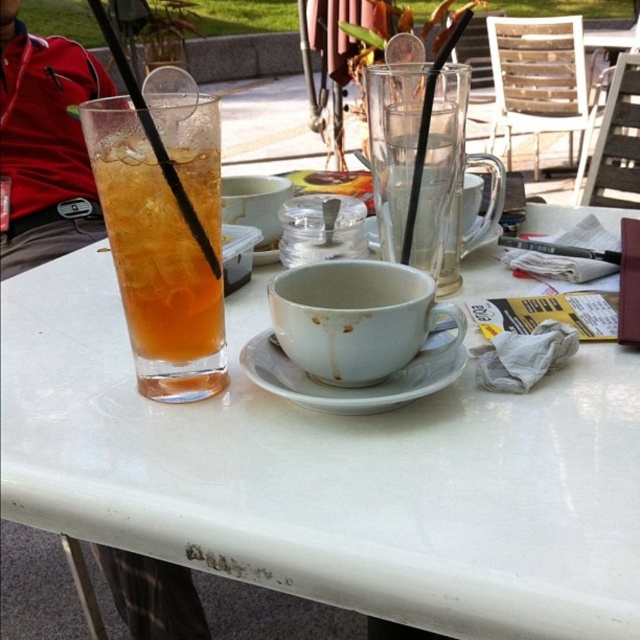
Question: Can you confirm if transparent glass cup at upper left is positioned below translucent glass drink at left?

Choices:
 (A) yes
 (B) no

Answer: (A)

Question: Which of the following is the closest to the observer?

Choices:
 (A) (120, 116)
 (B) (445, 628)
 (C) (202, 637)
 (D) (275, 392)

Answer: (B)

Question: Among these points, which one is farthest from the camera?

Choices:
 (A) (266, 316)
 (B) (115, 564)
 (C) (241, 355)

Answer: (B)

Question: Can you confirm if translucent glass drink at left is positioned below white ceramic saucer at center?

Choices:
 (A) no
 (B) yes

Answer: (A)

Question: Which of the following is the farthest from the observer?

Choices:
 (A) (120, 214)
 (B) (428, 371)
 (C) (122, 538)
 (D) (90, 228)

Answer: (D)

Question: Does transparent glass cup at upper left have a larger size compared to translucent glass drink at left?

Choices:
 (A) yes
 (B) no

Answer: (A)